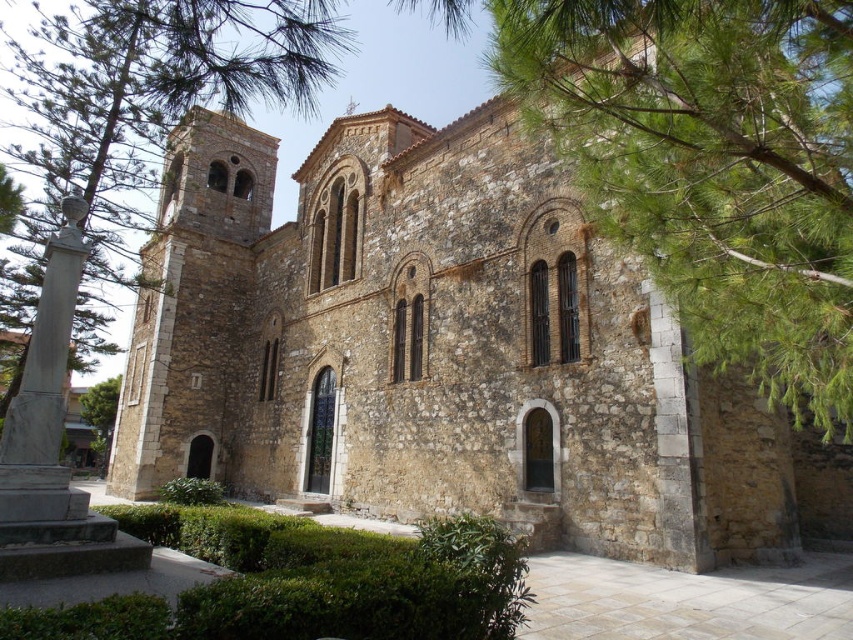
Question: Which of these objects is positioned farthest from the green leafy tree at upper left?

Choices:
 (A) green leafy tree at upper right
 (B) brown stone church at center
 (C) gray marble bust at left

Answer: (A)

Question: Which of these objects is positioned farthest from the green leafy tree at upper left?

Choices:
 (A) gray marble bust at left
 (B) brown stone church at center
 (C) green leafy tree at upper right

Answer: (C)

Question: Can you confirm if green leafy tree at upper left is bigger than gray marble bust at left?

Choices:
 (A) yes
 (B) no

Answer: (A)

Question: Which of the following is the closest to the observer?

Choices:
 (A) green leafy tree at upper left
 (B) brown stone church at center
 (C) green leafy tree at upper right
 (D) gray marble bust at left

Answer: (C)

Question: Can you confirm if green leafy tree at upper left is bigger than gray marble bust at left?

Choices:
 (A) no
 (B) yes

Answer: (B)

Question: Does green leafy tree at upper right appear over gray marble bust at left?

Choices:
 (A) no
 (B) yes

Answer: (B)